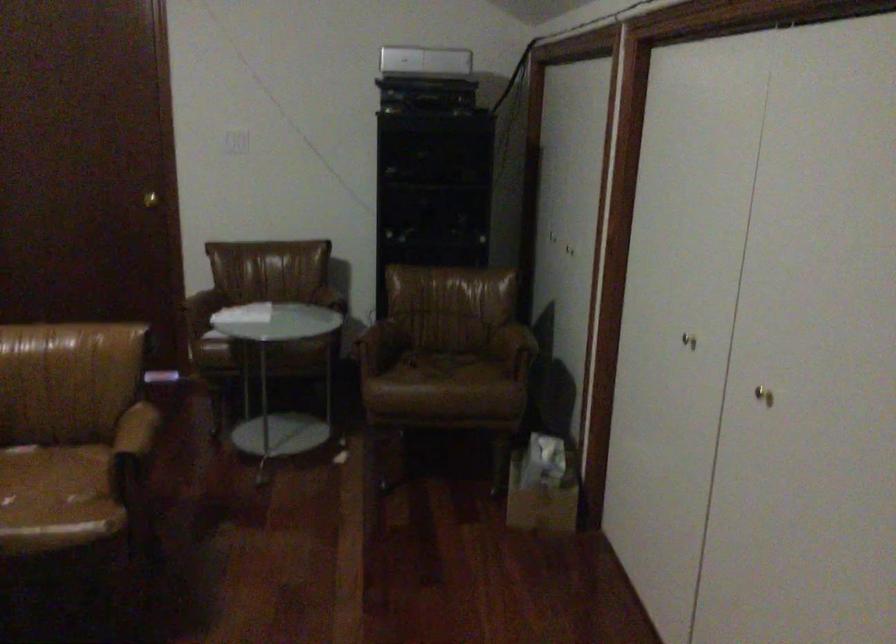
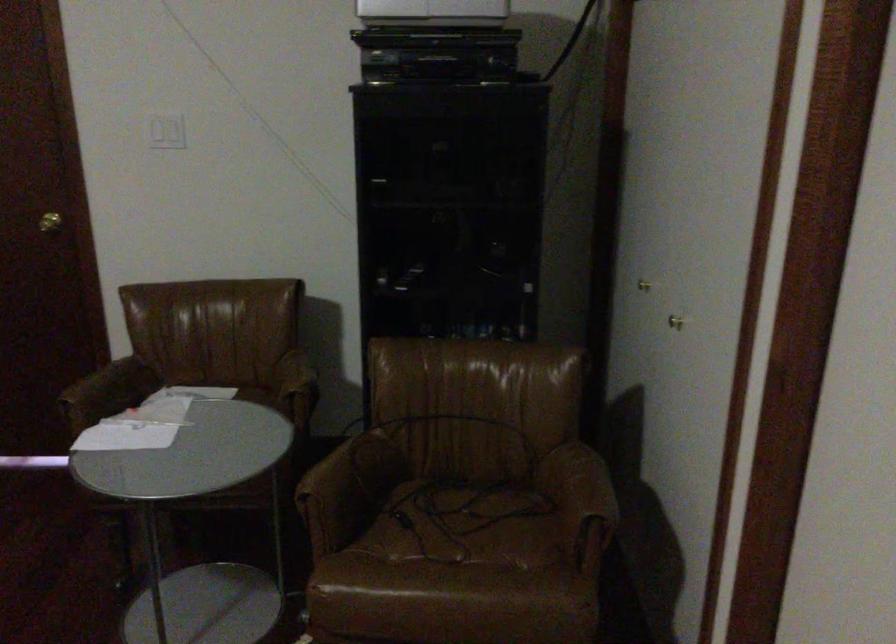
Where in the second image is the point corresponding to pixel 147 194 from the first image?

(49, 222)